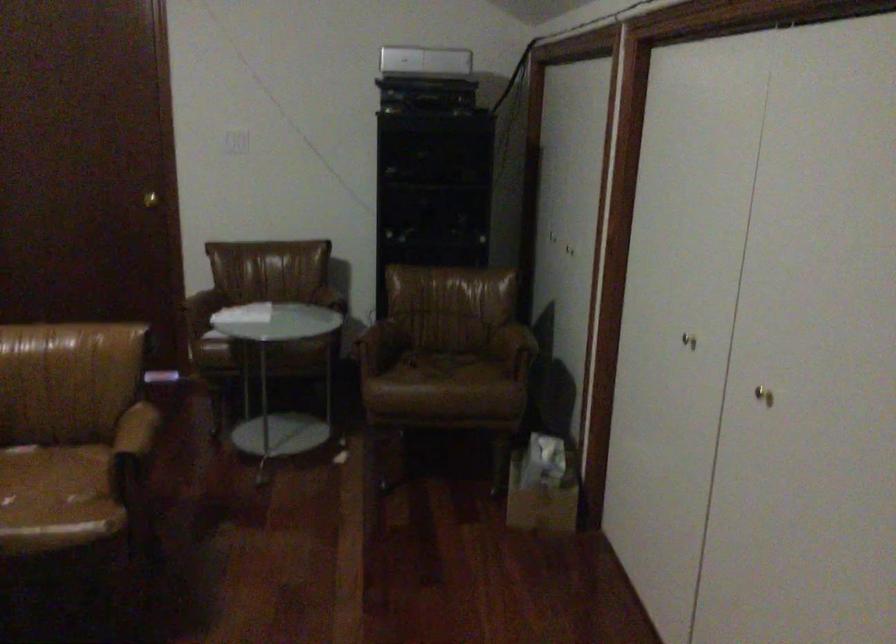
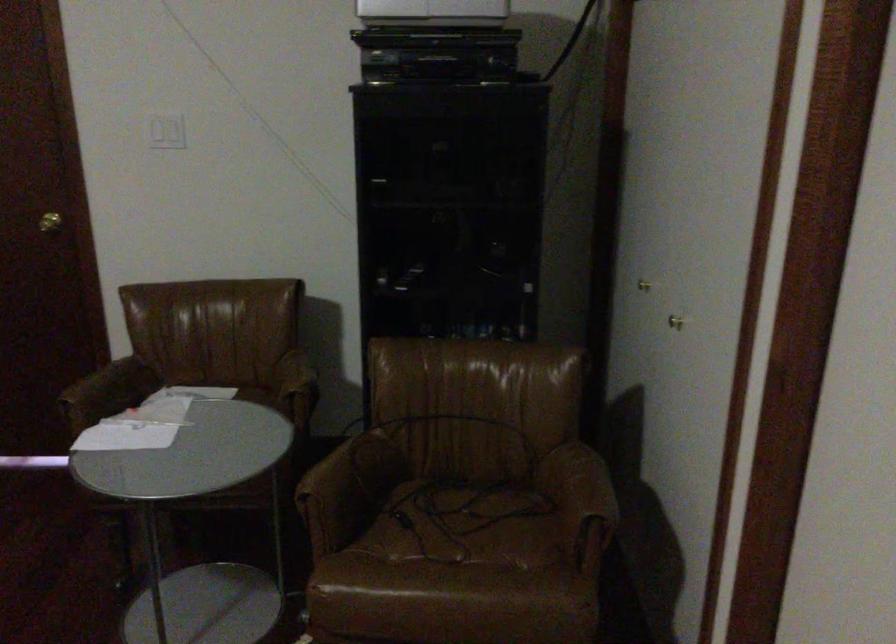
Where in the second image is the point corresponding to pixel 147 194 from the first image?

(49, 222)